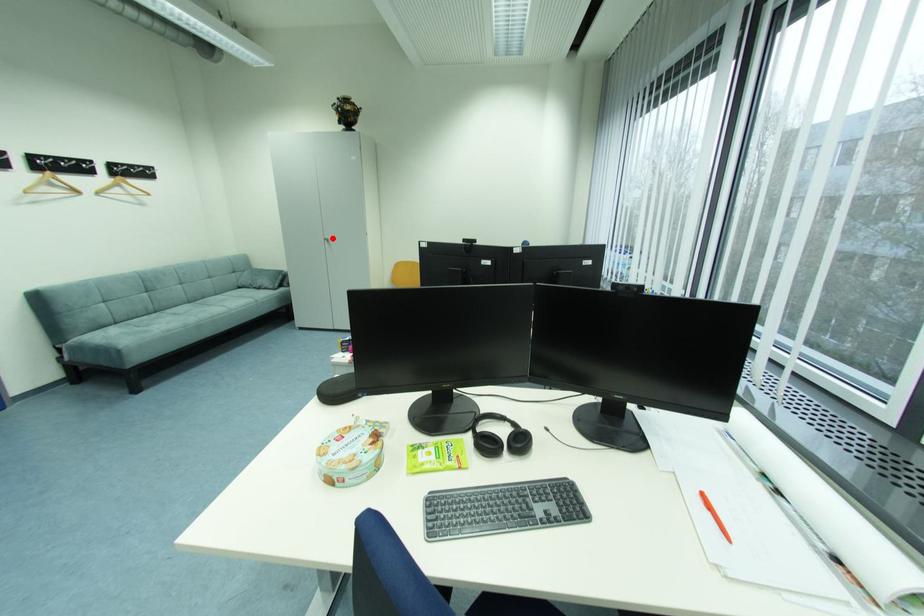
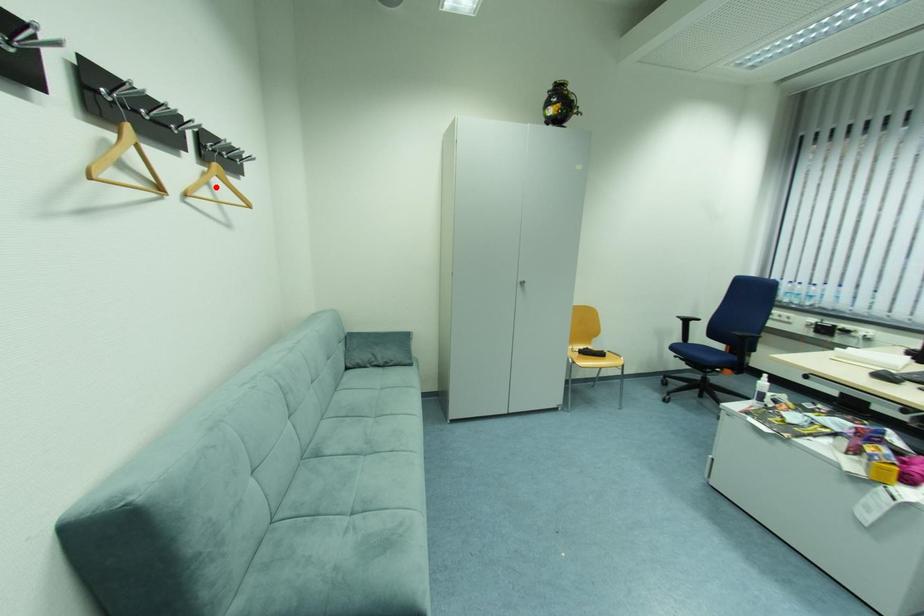
I am providing you with two images of the same scene from different viewpoints. A red point is marked on the first image and another point is marked on the second image. Are the points marked in image1 and image2 representing the same 3D position?

No